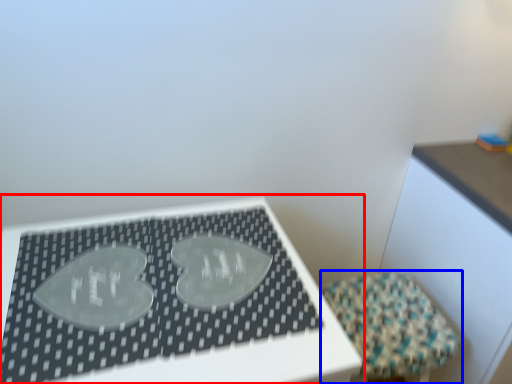
Question: Which point is further to the camera, table (highlighted by a red box) or furniture (highlighted by a blue box)?

Choices:
 (A) table
 (B) furniture

Answer: (B)